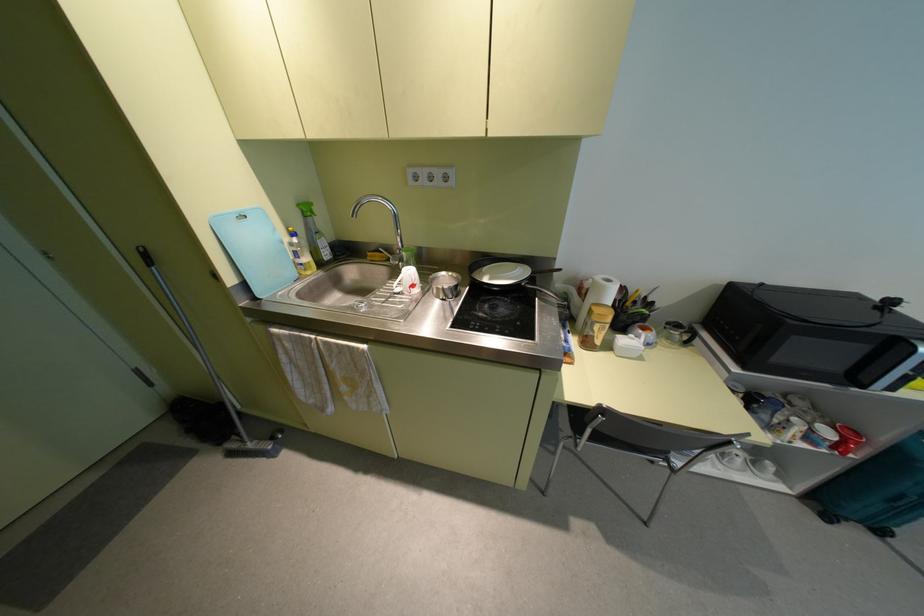
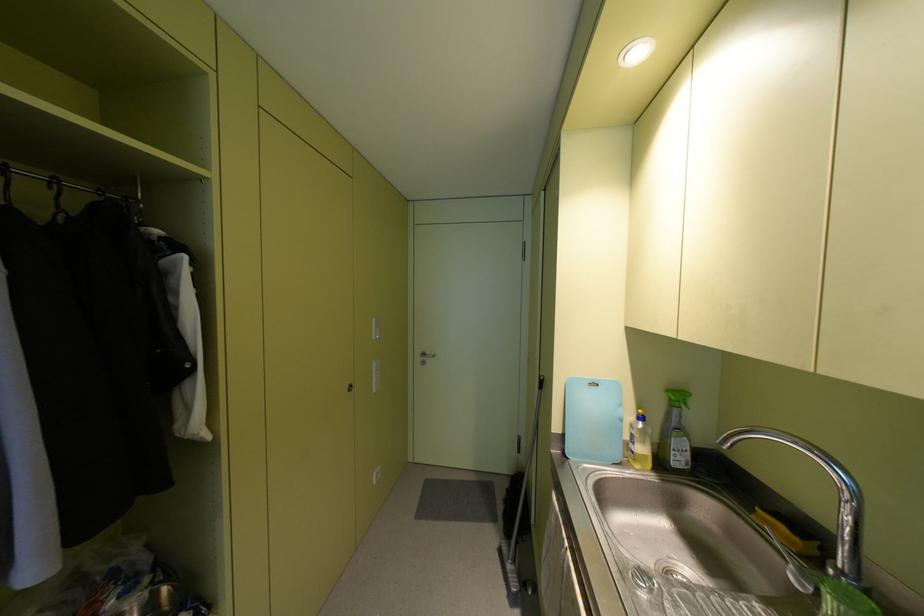
Question: How did the camera likely rotate?

Choices:
 (A) Left
 (B) Right
 (C) Up
 (D) Down

Answer: (A)